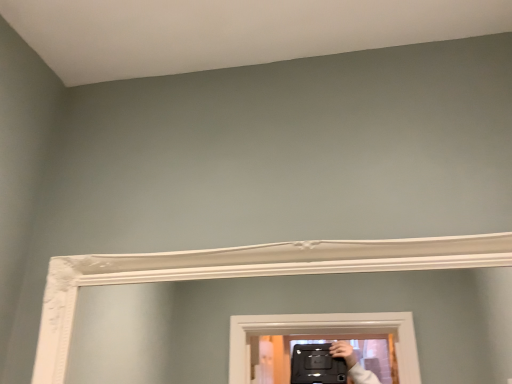
Describe the element at coordinates (288, 313) in the screenshot. The image size is (512, 384). I see `white glossy mirror at upper center` at that location.

Locate an element on the screen. The width and height of the screenshot is (512, 384). white glossy mirror at upper center is located at coordinates (288, 313).

Identify the location of white glossy mirror at upper center. (288, 313).